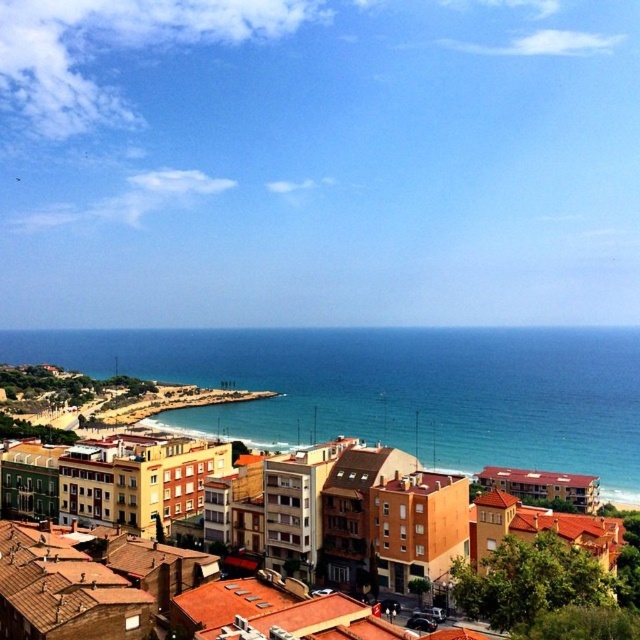
Question: Is blue water at center thinner than brown matte building at center?

Choices:
 (A) yes
 (B) no

Answer: (B)

Question: Is blue water at center closer to the viewer compared to brown matte building at center?

Choices:
 (A) no
 (B) yes

Answer: (A)

Question: Which object is farther from the camera taking this photo?

Choices:
 (A) brown matte building at center
 (B) blue water at center

Answer: (B)

Question: Where is blue water at center located in relation to brown matte building at center in the image?

Choices:
 (A) left
 (B) right

Answer: (A)